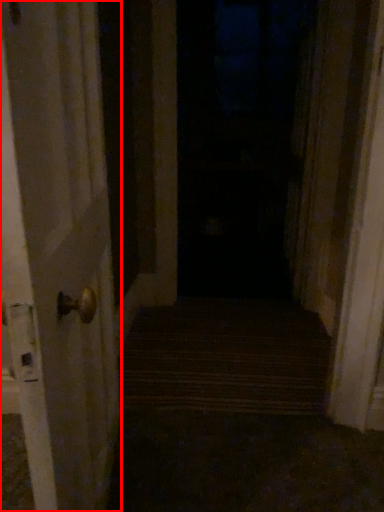
Question: Observing the image, what is the correct spatial positioning of door (annotated by the red box) in reference to window?

Choices:
 (A) left
 (B) right

Answer: (A)